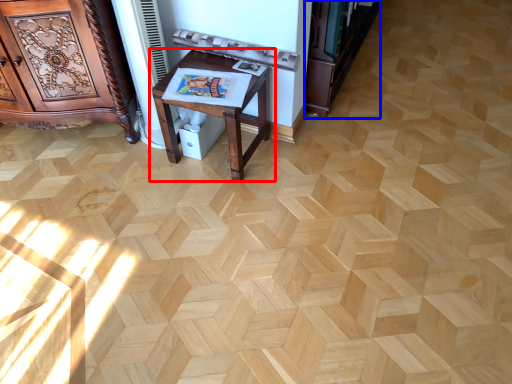
Question: Which point is closer to the camera, table (highlighted by a red box) or bookshelf (highlighted by a blue box)?

Choices:
 (A) table
 (B) bookshelf

Answer: (A)